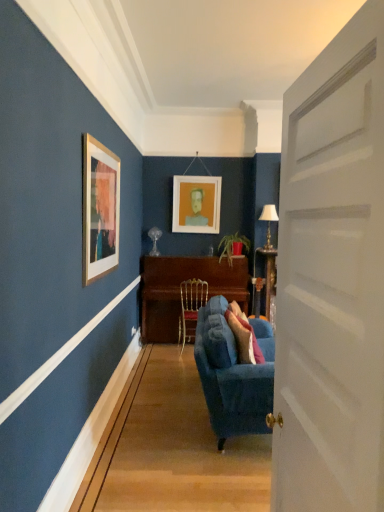
Find the location of `vacant space that is to the left of gold metallic chair at center`. vacant space that is to the left of gold metallic chair at center is located at coordinates (158, 349).